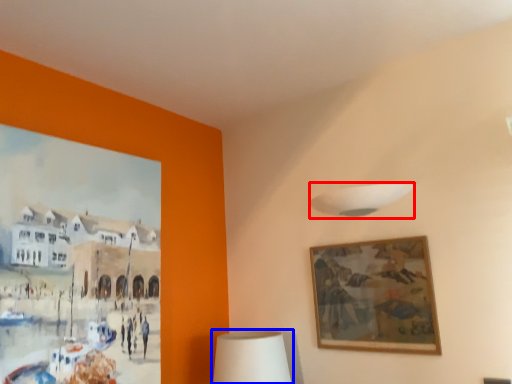
Question: Which of the following is the farthest to the observer, lamp (highlighted by a red box) or table lamp (highlighted by a blue box)?

Choices:
 (A) lamp
 (B) table lamp

Answer: (B)